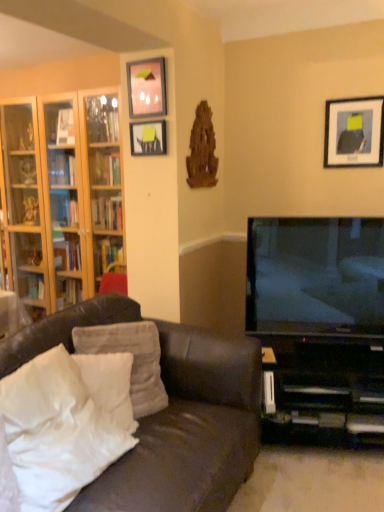
Question: From a real-world perspective, relative to matte glass picture frame at upper center, the second picture frame positioned from the right, is matte black tv at right vertically above or below?

Choices:
 (A) above
 (B) below

Answer: (B)

Question: From the image's perspective, is matte black tv at right positioned above or below matte glass picture frame at upper center, the 2th picture frame in the left-to-right sequence?

Choices:
 (A) below
 (B) above

Answer: (A)

Question: Based on their relative distances, which object is farther from the matte black picture frame at upper right, the 3th picture frame viewed from the left?

Choices:
 (A) white soft pillow at lower left, which is counted as the third pillow, starting from the front
 (B) clear glass shelves at left
 (C) wooden bookshelf at left
 (D) white soft pillow at lower left, the second pillow when ordered from back to front
 (E) matte black picture frame at upper center, arranged as the third picture frame when viewed from the right

Answer: (B)

Question: Which of these objects is positioned closest to the brown leather couch at lower left?

Choices:
 (A) white soft pillow at lower left, the second pillow when ordered from back to front
 (B) matte black picture frame at upper right, the 3th picture frame viewed from the left
 (C) matte black picture frame at upper center, placed as the first picture frame when sorted from left to right
 (D) wooden bookshelf at left
 (E) matte glass picture frame at upper center, the second picture frame positioned from the right

Answer: (A)